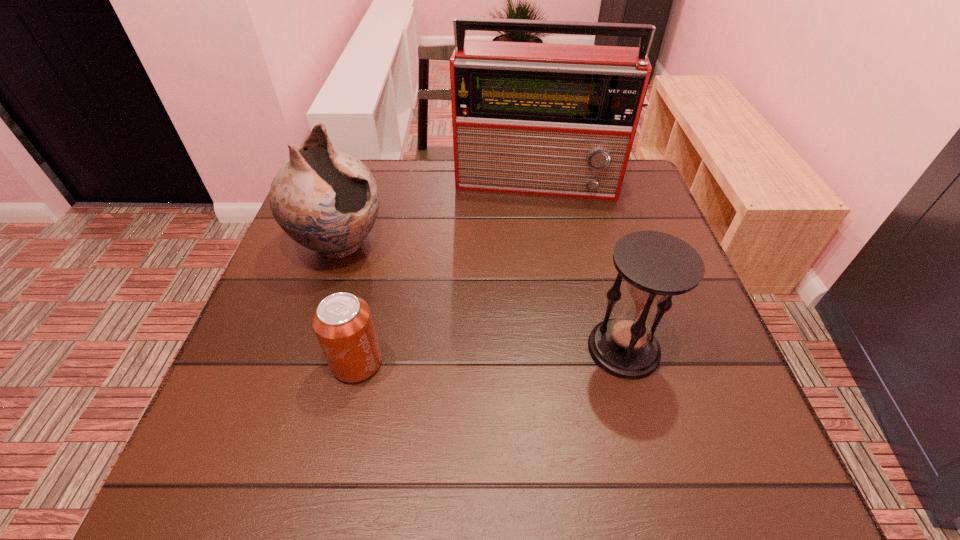
The height and width of the screenshot is (540, 960). Identify the location of free space on the desktop that is between the shortest object and the second shortest object and is positioned from the spout of the second tallest object. (520, 354).

Locate an element on the screen. The image size is (960, 540). free space on the desktop that is between the shortest object and the second shortest object and is positioned on the front-facing side of the farthest object is located at coordinates (531, 354).